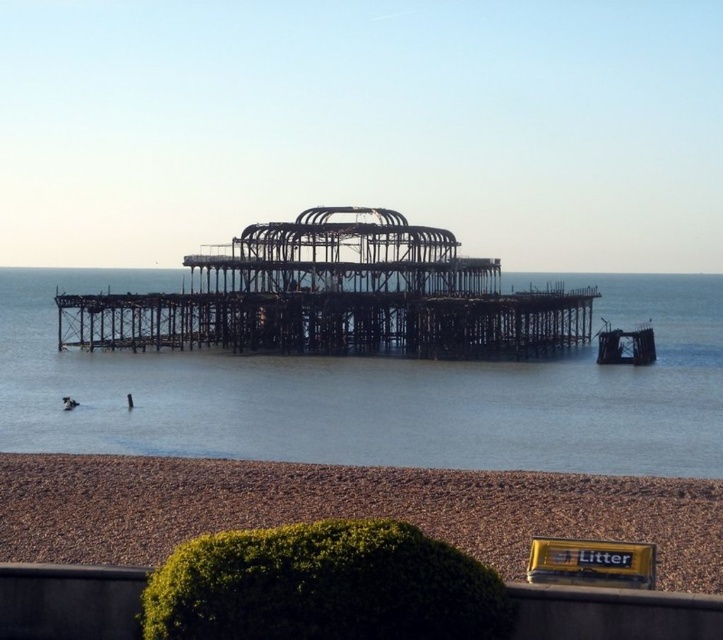
Question: Does rusty metal boat at center appear over dark skin human at lower left?

Choices:
 (A) no
 (B) yes

Answer: (B)

Question: Estimate the real-world distances between objects in this image. Which object is closer to the brown gravel at lower center?

Choices:
 (A) rusty metal boat at center
 (B) dark skin human at lower left
 (C) transparent water at center

Answer: (C)

Question: Considering the relative positions of transparent water at center and dark skin human at lower left in the image provided, where is transparent water at center located with respect to dark skin human at lower left?

Choices:
 (A) above
 (B) below

Answer: (A)

Question: Does dark blue fabric at lower left come behind dark skin human at lower left?

Choices:
 (A) yes
 (B) no

Answer: (A)

Question: Which of the following is the farthest from the observer?

Choices:
 (A) rusty metal boat at center
 (B) brown gravel at lower center
 (C) dark blue fabric at lower left

Answer: (A)

Question: Which of the following is the farthest from the observer?

Choices:
 (A) (429, 326)
 (B) (359, 499)
 (C) (654, 355)
 (D) (128, 400)

Answer: (C)